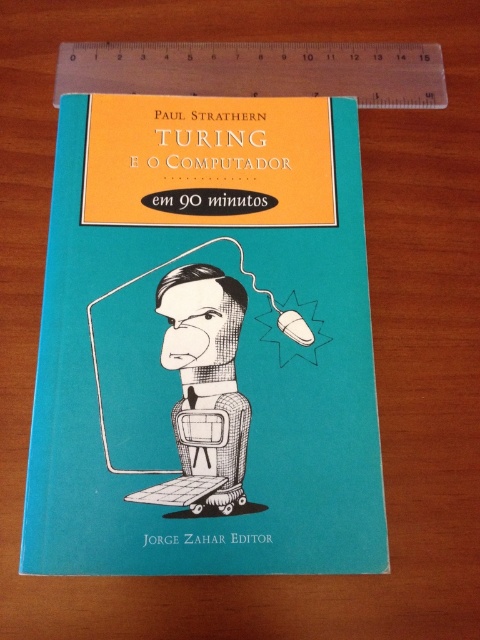
In the scene shown: How much distance is there between teal matte book cover at center and transparent plastic ruler at top?

The distance of teal matte book cover at center from transparent plastic ruler at top is 25.86 centimeters.

Between teal matte book cover at center and transparent plastic ruler at top, which one appears on the right side from the viewer's perspective?

Positioned to the right is transparent plastic ruler at top.

Is point (311, 244) more distant than point (143, 51)?

No, (311, 244) is closer to viewer.

The height and width of the screenshot is (640, 480). What are the coordinates of `teal matte book cover at center` in the screenshot? It's located at (204, 342).

Based on the photo, is teal matte book cover at center smaller than black textured robot at center?

No, teal matte book cover at center is not smaller than black textured robot at center.

Is teal matte book cover at center positioned before black textured robot at center?

Yes.

Locate an element on the screen. The width and height of the screenshot is (480, 640). teal matte book cover at center is located at coordinates (204, 342).

Locate an element on the screen. The width and height of the screenshot is (480, 640). teal matte book cover at center is located at coordinates (204, 342).

Between transparent plastic ruler at top and black textured robot at center, which one is positioned higher?

transparent plastic ruler at top is higher up.

Which is below, transparent plastic ruler at top or black textured robot at center?

Positioned lower is black textured robot at center.

Which is behind, point (404, 102) or point (188, 284)?

Point (404, 102)

Locate an element on the screen. Image resolution: width=480 pixels, height=640 pixels. transparent plastic ruler at top is located at coordinates (259, 70).